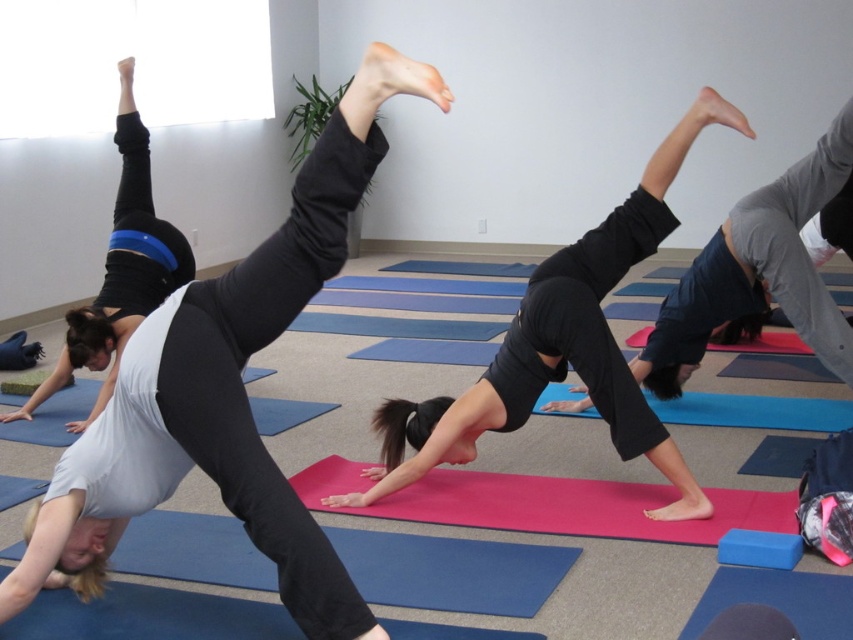
Question: Which of these objects is positioned closest to the matte black leggings at center?

Choices:
 (A) black matte yoga pants at center
 (B) matte black leggings at upper center

Answer: (B)

Question: Which object is the closest to the matte black leggings at center?

Choices:
 (A) pink rubber yoga mat at center
 (B) matte black leggings at upper center
 (C) black matte yoga pants at center

Answer: (A)

Question: Can you confirm if black matte yoga pants at center is bigger than matte black leggings at center?

Choices:
 (A) no
 (B) yes

Answer: (B)

Question: Is matte black leggings at upper center above pink rubber yoga mat at center?

Choices:
 (A) no
 (B) yes

Answer: (B)

Question: Estimate the real-world distances between objects in this image. Which object is farther from the pink rubber yoga mat at center?

Choices:
 (A) matte black leggings at center
 (B) black matte yoga pants at center

Answer: (A)

Question: Does black matte yoga pants at center come behind matte black leggings at center?

Choices:
 (A) no
 (B) yes

Answer: (A)